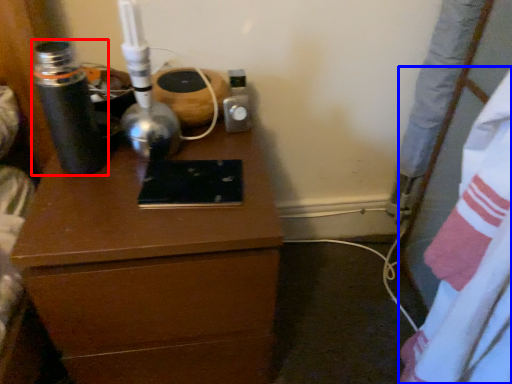
Question: Which object is closer to the camera taking this photo, bottle (highlighted by a red box) or sheet (highlighted by a blue box)?

Choices:
 (A) bottle
 (B) sheet

Answer: (B)